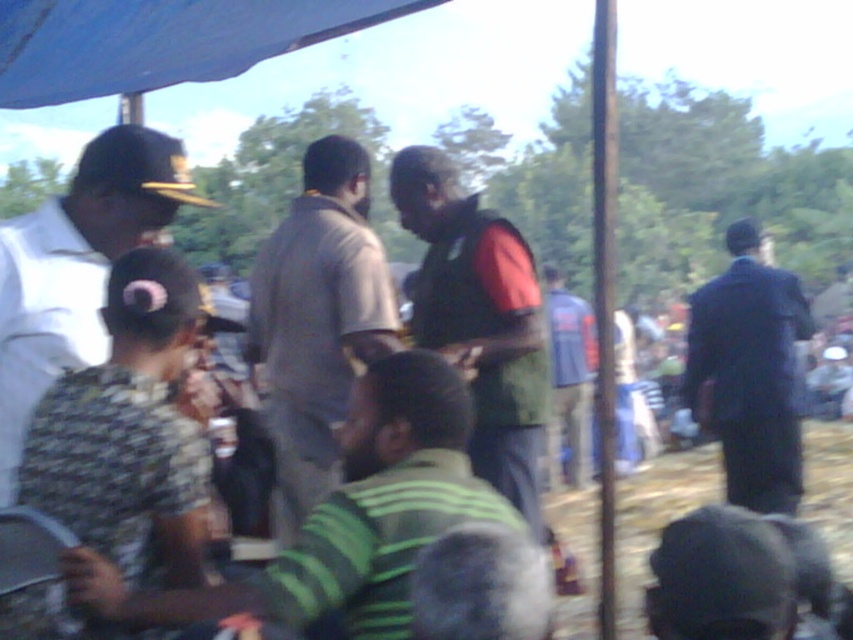
Between camouflage fabric shirt at lower left and dark blue suit at right, which one is positioned lower?

camouflage fabric shirt at lower left is below.

What do you see at coordinates (345, 516) in the screenshot?
I see `camouflage fabric shirt at lower left` at bounding box center [345, 516].

Does point (403, 355) come behind point (714, 422)?

No, (403, 355) is closer to viewer.

Locate an element on the screen. This screenshot has height=640, width=853. camouflage fabric shirt at lower left is located at coordinates (345, 516).

Where is `camouflage fabric shirt at lower left`? This screenshot has width=853, height=640. camouflage fabric shirt at lower left is located at coordinates (345, 516).

Does camouflage fabric shirt at lower left have a smaller size compared to gray cotton shirt at center?

Indeed, camouflage fabric shirt at lower left has a smaller size compared to gray cotton shirt at center.

The image size is (853, 640). I want to click on camouflage fabric shirt at lower left, so click(x=345, y=516).

Locate an element on the screen. Image resolution: width=853 pixels, height=640 pixels. camouflage fabric shirt at lower left is located at coordinates (345, 516).

Which is more to the right, green matte vest at center or dark blue suit at right?

dark blue suit at right

Can you confirm if green matte vest at center is bigger than dark blue suit at right?

Incorrect, green matte vest at center is not larger than dark blue suit at right.

Which is behind, point (503, 422) or point (751, 352)?

Positioned behind is point (751, 352).

You are a GUI agent. You are given a task and a screenshot of the screen. Output one action in this format:
    pyautogui.click(x=<x>, y=<y>)
    Task: Click on the green matte vest at center
    The width and height of the screenshot is (853, 640).
    Given the screenshot: What is the action you would take?
    pyautogui.click(x=480, y=317)